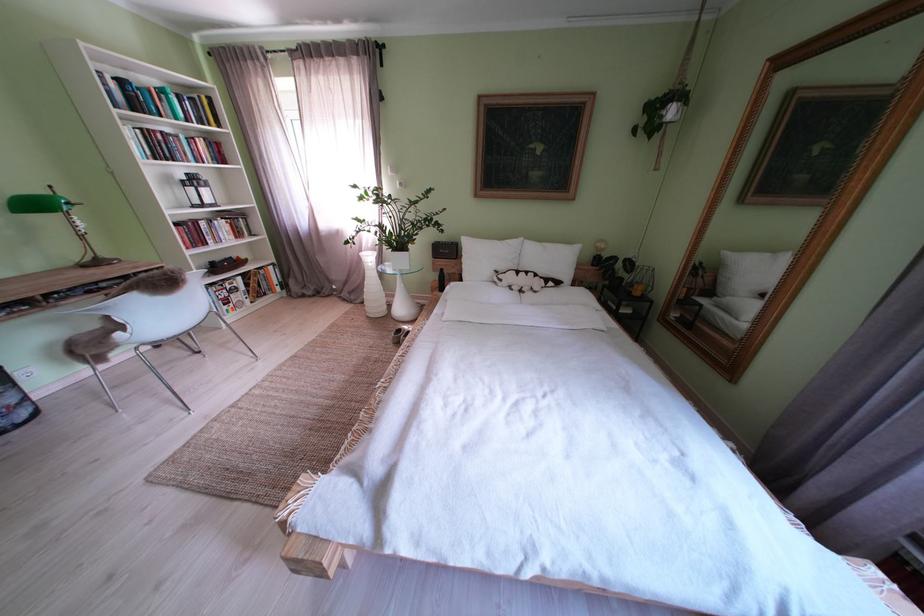
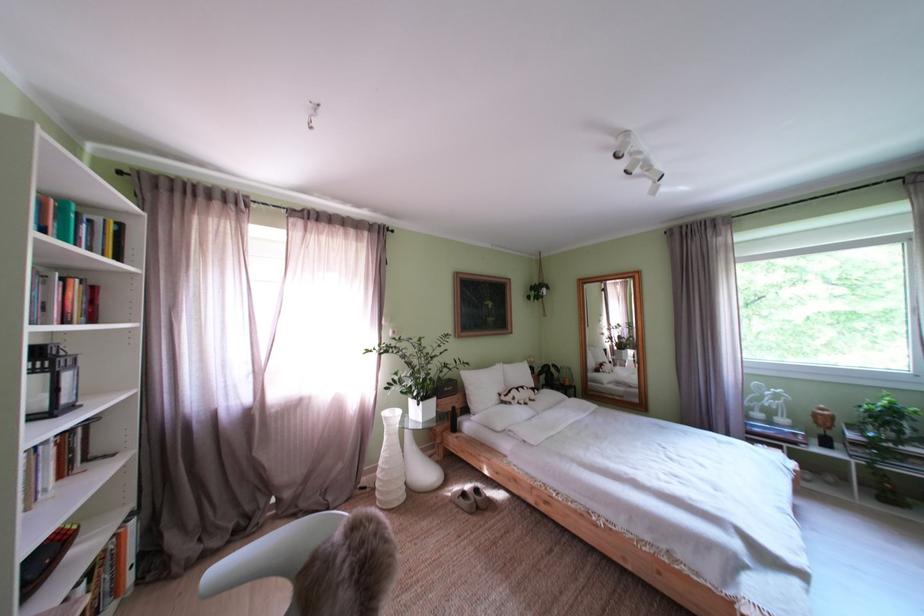
The point at (512, 285) is marked in the first image. Where is the corresponding point in the second image?

(525, 405)